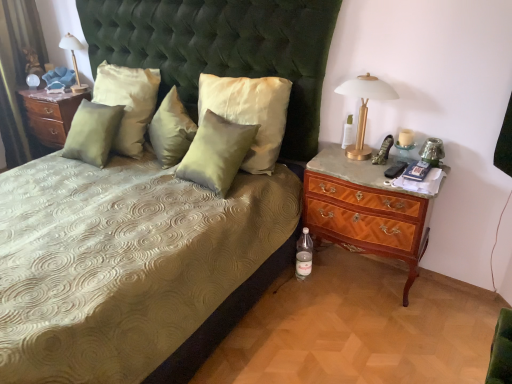
I want to click on space that is in front of gold metallic table lamp at upper right, acting as the 1th bedside lamp starting from the bottom, so click(357, 171).